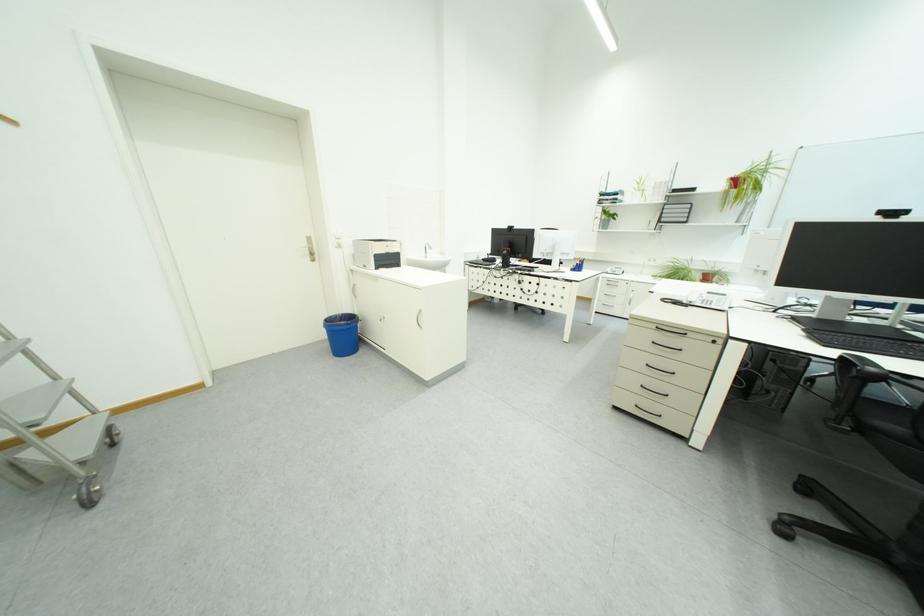
This screenshot has width=924, height=616. Identify the location of black chair armrest. (845, 377).